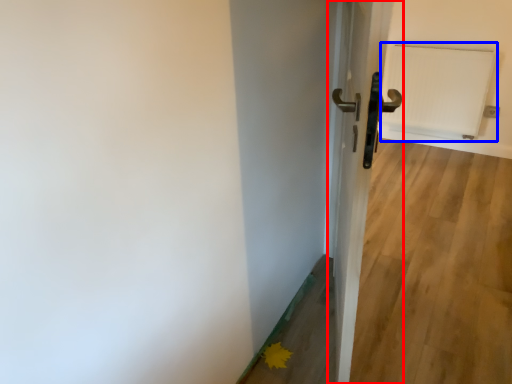
Question: Which object appears farthest to the camera in this image, door (highlighted by a red box) or radiator (highlighted by a blue box)?

Choices:
 (A) door
 (B) radiator

Answer: (B)